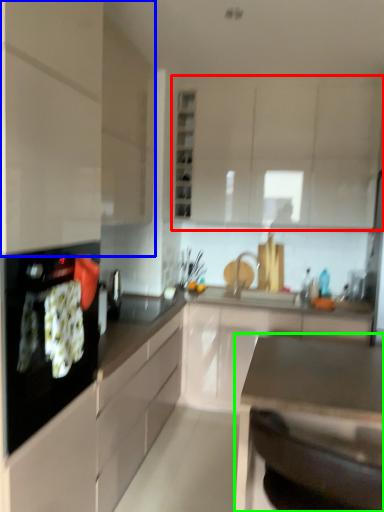
Question: Based on their relative distances, which object is farther from cabinetry (highlighted by a red box)? Choose from cabinetry (highlighted by a blue box) and countertop (highlighted by a green box).

Choices:
 (A) cabinetry
 (B) countertop

Answer: (B)